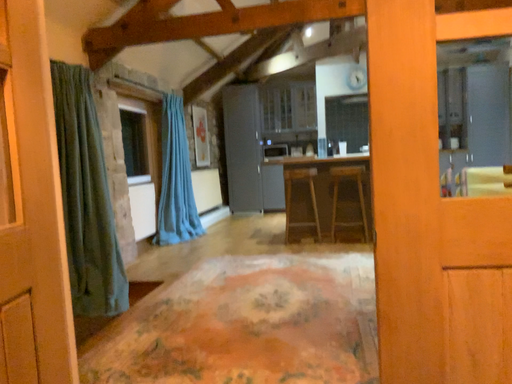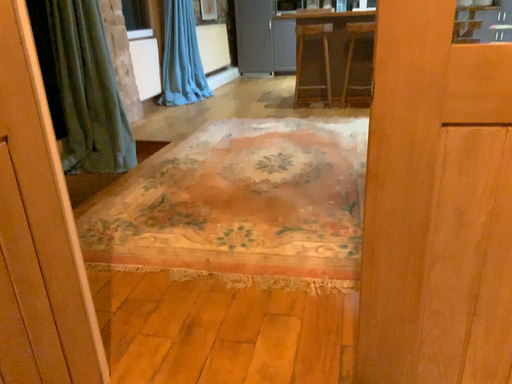
Question: How did the camera likely rotate when shooting the video?

Choices:
 (A) rotated downward
 (B) rotated upward

Answer: (A)